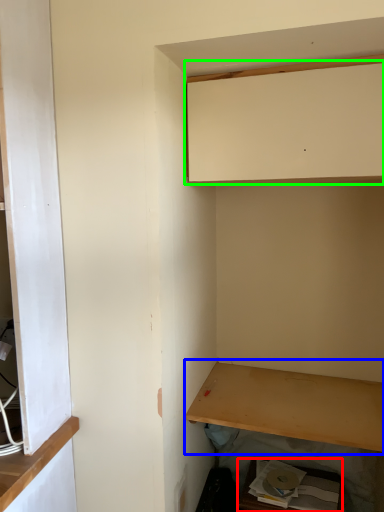
Question: Estimate the real-world distances between objects in this image. Which object is farther from cabinetry (highlighted by a red box), shelf (highlighted by a blue box) or cabinetry (highlighted by a green box)?

Choices:
 (A) shelf
 (B) cabinetry

Answer: (B)